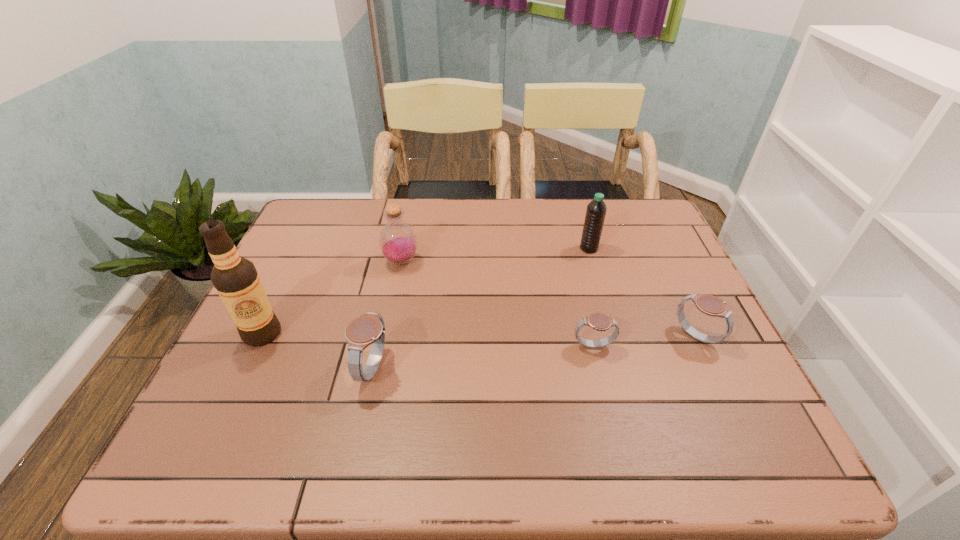
You are a GUI agent. You are given a task and a screenshot of the screen. Output one action in this format:
    pyautogui.click(x=<x>, y=<y>)
    Task: Click on the third shortest object
    
    Given the screenshot: What is the action you would take?
    pyautogui.click(x=369, y=329)

Find the location of a particular element. The width and height of the screenshot is (960, 540). the tallest watch is located at coordinates pos(369,329).

At what (x,y) coordinates should I click in order to perform the action: click on the shortest watch. Please return your answer as a coordinate pair (x, y). This screenshot has width=960, height=540. Looking at the image, I should click on (x=598, y=321).

The width and height of the screenshot is (960, 540). What are the coordinates of `the second watch from right to left` in the screenshot? It's located at (598, 321).

The height and width of the screenshot is (540, 960). I want to click on the second tallest watch, so click(711, 305).

At what (x,y) coordinates should I click in order to perform the action: click on the rightmost watch. Please return your answer as a coordinate pair (x, y). The width and height of the screenshot is (960, 540). Looking at the image, I should click on (711, 305).

You are a GUI agent. You are given a task and a screenshot of the screen. Output one action in this format:
    pyautogui.click(x=<x>, y=<y>)
    Task: Click on the bottle
    
    Given the screenshot: What is the action you would take?
    pyautogui.click(x=398, y=243)

Identify the location of water bottle. (596, 210).

I want to click on the tallest object, so click(235, 278).

Where is `the leftmost object`? This screenshot has height=540, width=960. the leftmost object is located at coordinates (235, 278).